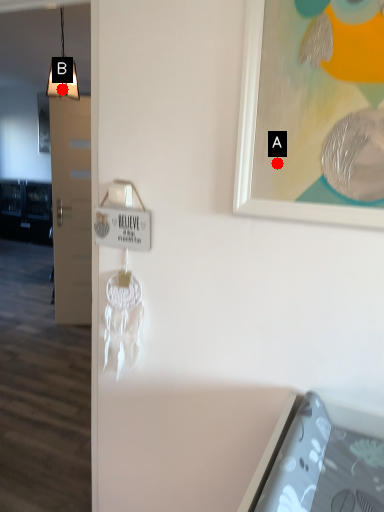
Question: Two points are circled on the image, labeled by A and B beside each circle. Which point is farther to the camera?

Choices:
 (A) A is further
 (B) B is further

Answer: (B)